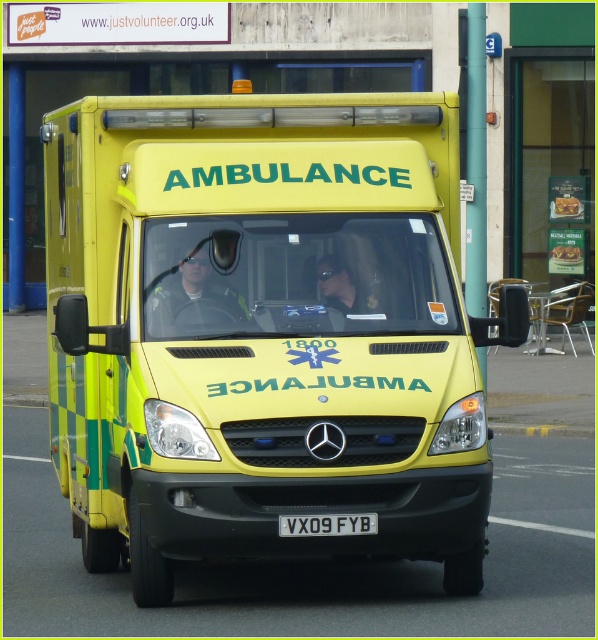
You are a pedestrian standing on the sidewalk looking at the ambulance. You see the reflective safety vest at center and the white plastic license plate at center. Which object is closer to you?

The reflective safety vest at center is closer to you because it is further to the viewer than the white plastic license plate at center.

You are a pedestrian standing on the sidewalk and see the yellow matte ambulance at center and the reflective safety vest at center. Which object is bigger in size?

The yellow matte ambulance at center is larger in size compared to the reflective safety vest at center.

You are standing 30 feet away from the reflective safety vest at center. Can you safely step forward to touch it without moving past the ambulance?

The reflective safety vest at center is only 28.35 feet away from you, so yes, you can safely step forward to touch it without moving past the ambulance as you are already within the 30 feet distance.